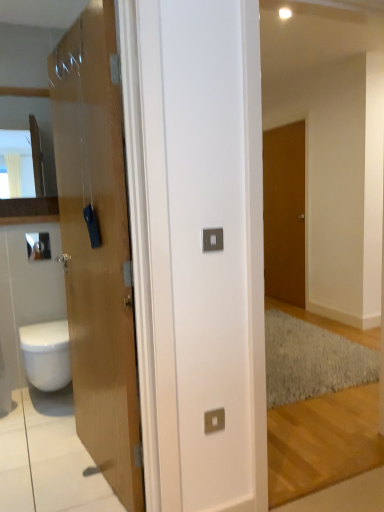
Locate an element on the screen. vacant space situated on the left part of matte wooden door at left, placed as the second door when sorted from back to front is located at coordinates (27, 460).